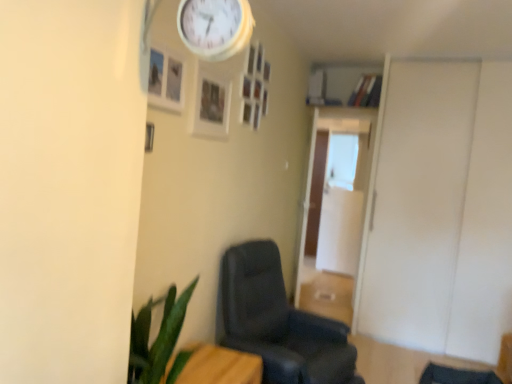
Question: Is transparent glass door at center, which appears as the first glass door when viewed from the front, oriented towards matte black chair at center?

Choices:
 (A) no
 (B) yes

Answer: (B)

Question: Is transparent glass door at center, which ranks as the second glass door in back-to-front order, not inside matte black chair at center?

Choices:
 (A) yes
 (B) no

Answer: (A)

Question: Can you confirm if transparent glass door at center, which appears as the first glass door when viewed from the front, is shorter than matte black chair at center?

Choices:
 (A) yes
 (B) no

Answer: (B)

Question: Considering the relative positions of transparent glass door at center, which appears as the first glass door when viewed from the front, and matte black chair at center in the image provided, is transparent glass door at center, which appears as the first glass door when viewed from the front, in front of matte black chair at center?

Choices:
 (A) yes
 (B) no

Answer: (B)

Question: Does transparent glass door at center, which appears as the first glass door when viewed from the front, contain matte black chair at center?

Choices:
 (A) yes
 (B) no

Answer: (B)

Question: Is transparent glass door at center, which appears as the first glass door when viewed from the front, bigger than matte black chair at center?

Choices:
 (A) no
 (B) yes

Answer: (A)

Question: Does matte black chair at center contain white wooden clock at upper center?

Choices:
 (A) yes
 (B) no

Answer: (B)

Question: Can you confirm if matte black chair at center is positioned to the left of white wooden clock at upper center?

Choices:
 (A) no
 (B) yes

Answer: (A)

Question: Is matte black chair at center aimed at white wooden clock at upper center?

Choices:
 (A) no
 (B) yes

Answer: (A)

Question: Considering the relative positions of matte black chair at center and white wooden clock at upper center in the image provided, is matte black chair at center to the right of white wooden clock at upper center from the viewer's perspective?

Choices:
 (A) no
 (B) yes

Answer: (B)

Question: Does matte black chair at center have a greater height compared to white wooden clock at upper center?

Choices:
 (A) yes
 (B) no

Answer: (A)

Question: Does matte black chair at center have a greater width compared to white wooden clock at upper center?

Choices:
 (A) no
 (B) yes

Answer: (B)

Question: Considering the relative sizes of white matte door at right and wooden table at lower left in the image provided, is white matte door at right thinner than wooden table at lower left?

Choices:
 (A) yes
 (B) no

Answer: (B)